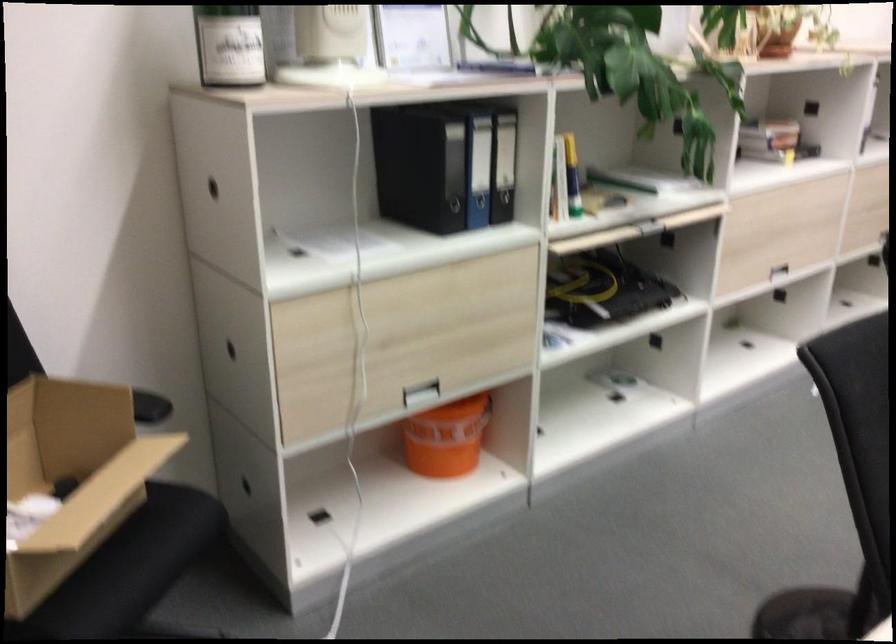
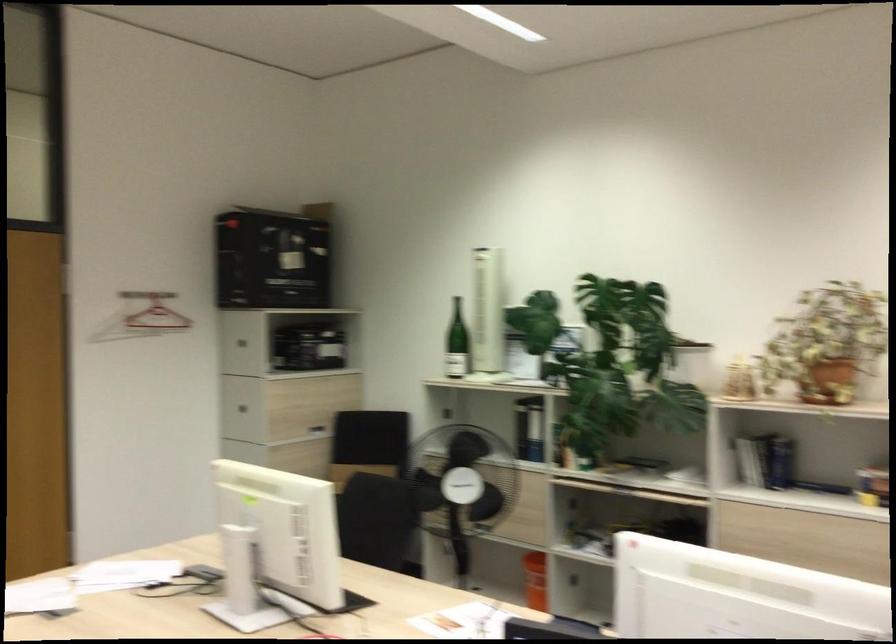
Question: I am providing you with two images of the same scene from different viewpoints. After the viewpoint changes to image2, which objects are now occluded?

Choices:
 (A) white plastic cup
 (B) drawer pull
 (C) black binder
 (D) open cardboard box

Answer: (D)